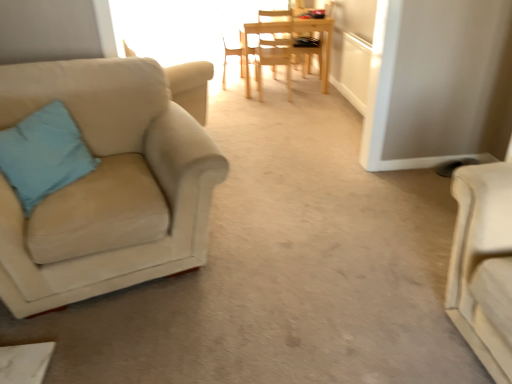
Question: Is suede beige armchair at left, which ranks as the 1th chair in front-to-back order, surrounding light wood chair at center, acting as the 3th chair starting from the front?

Choices:
 (A) no
 (B) yes

Answer: (A)

Question: Are suede beige armchair at left, which ranks as the 5th chair in back-to-front order, and light wood chair at center, acting as the 3th chair starting from the front, located far from each other?

Choices:
 (A) no
 (B) yes

Answer: (B)

Question: Is suede beige armchair at left, which ranks as the 5th chair in back-to-front order, positioned beyond the bounds of light wood chair at center, acting as the 3th chair starting from the front?

Choices:
 (A) no
 (B) yes

Answer: (B)

Question: From the image's perspective, is suede beige armchair at left, which ranks as the 1th chair in front-to-back order, above light wood chair at center, the third chair in the back-to-front sequence?

Choices:
 (A) no
 (B) yes

Answer: (A)

Question: From a real-world perspective, is suede beige armchair at left, which ranks as the 5th chair in back-to-front order, below light wood chair at center, acting as the 3th chair starting from the front?

Choices:
 (A) no
 (B) yes

Answer: (A)

Question: Is suede beige armchair at left, which ranks as the 5th chair in back-to-front order, thinner than light wood chair at center, acting as the 3th chair starting from the front?

Choices:
 (A) no
 (B) yes

Answer: (A)

Question: Is suede beige armchair at left, which ranks as the 1th chair in front-to-back order, completely or partially inside blue fabric pillow at left?

Choices:
 (A) no
 (B) yes

Answer: (A)

Question: From the image's perspective, is blue fabric pillow at left located above suede beige armchair at left, which ranks as the 5th chair in back-to-front order?

Choices:
 (A) yes
 (B) no

Answer: (A)

Question: Does blue fabric pillow at left have a larger size compared to suede beige armchair at left, which ranks as the 5th chair in back-to-front order?

Choices:
 (A) no
 (B) yes

Answer: (A)

Question: Can you confirm if blue fabric pillow at left is wider than suede beige armchair at left, which ranks as the 1th chair in front-to-back order?

Choices:
 (A) yes
 (B) no

Answer: (B)

Question: Can you confirm if blue fabric pillow at left is positioned to the right of suede beige armchair at left, which ranks as the 1th chair in front-to-back order?

Choices:
 (A) yes
 (B) no

Answer: (B)

Question: Is blue fabric pillow at left touching suede beige armchair at left, which ranks as the 1th chair in front-to-back order?

Choices:
 (A) yes
 (B) no

Answer: (B)

Question: Could you tell me if wooden chair at center, the 1th chair in the back-to-front sequence, is turned towards light wood chair at center, acting as the 3th chair starting from the front?

Choices:
 (A) yes
 (B) no

Answer: (A)